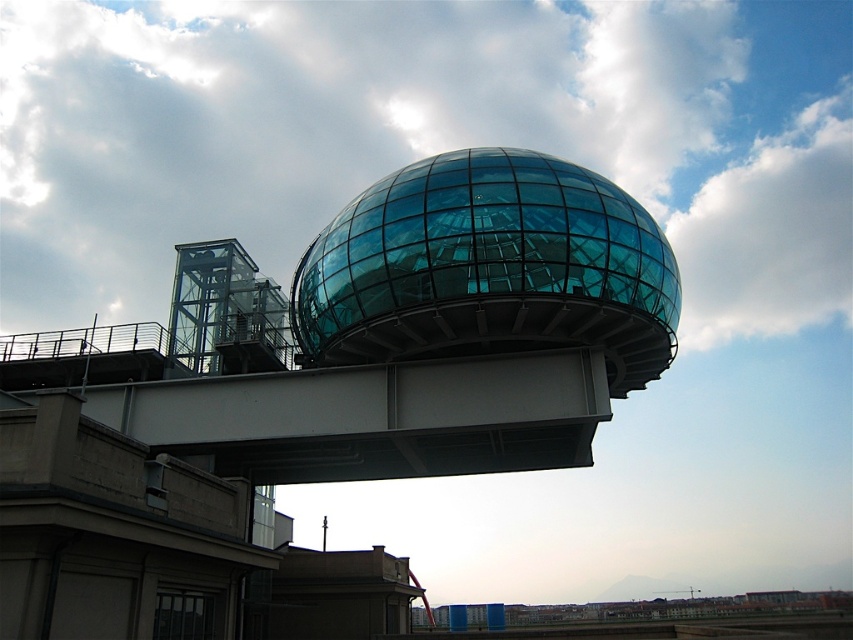
Who is higher up, transparent glass sphere at center or white metallic overpass at center?

transparent glass sphere at center

Is transparent glass sphere at center above white metallic overpass at center?

Yes.

The height and width of the screenshot is (640, 853). Describe the element at coordinates (489, 268) in the screenshot. I see `transparent glass sphere at center` at that location.

Where is `transparent glass sphere at center`? transparent glass sphere at center is located at coordinates (489, 268).